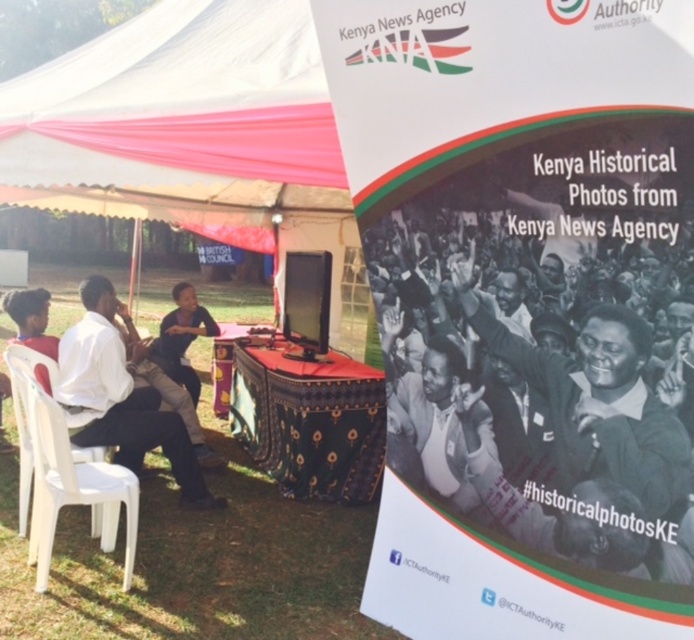
Question: Among these objects, which one is nearest to the camera?

Choices:
 (A) dark brown skin at center
 (B) white matte shirt at left

Answer: (B)

Question: Does white paper poster at upper right appear under white plastic chair at left?

Choices:
 (A) no
 (B) yes

Answer: (A)

Question: Among these points, which one is nearest to the camera?

Choices:
 (A) (171, 353)
 (B) (604, 291)
 (C) (74, 420)
 (D) (266, 420)

Answer: (B)

Question: Does white matte shirt at left lie in front of dark brown skin at center?

Choices:
 (A) yes
 (B) no

Answer: (A)

Question: Does white paper poster at upper right have a larger size compared to white plastic chair at left?

Choices:
 (A) no
 (B) yes

Answer: (B)

Question: Which of the following is the closest to the observer?

Choices:
 (A) white matte shirt at left
 (B) white plastic chair at left
 (C) patterned fabric table at center

Answer: (B)